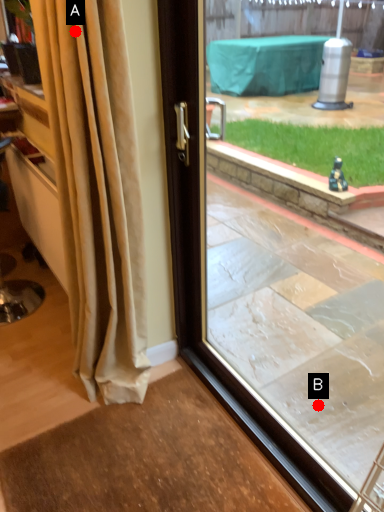
Question: Two points are circled on the image, labeled by A and B beside each circle. Which point is farther from the camera taking this photo?

Choices:
 (A) A is further
 (B) B is further

Answer: (B)